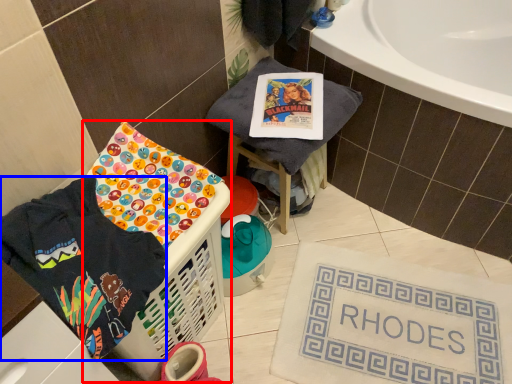
Question: Among these objects, which one is farthest to the camera, basket container (highlighted by a red box) or clothing (highlighted by a blue box)?

Choices:
 (A) basket container
 (B) clothing

Answer: (A)